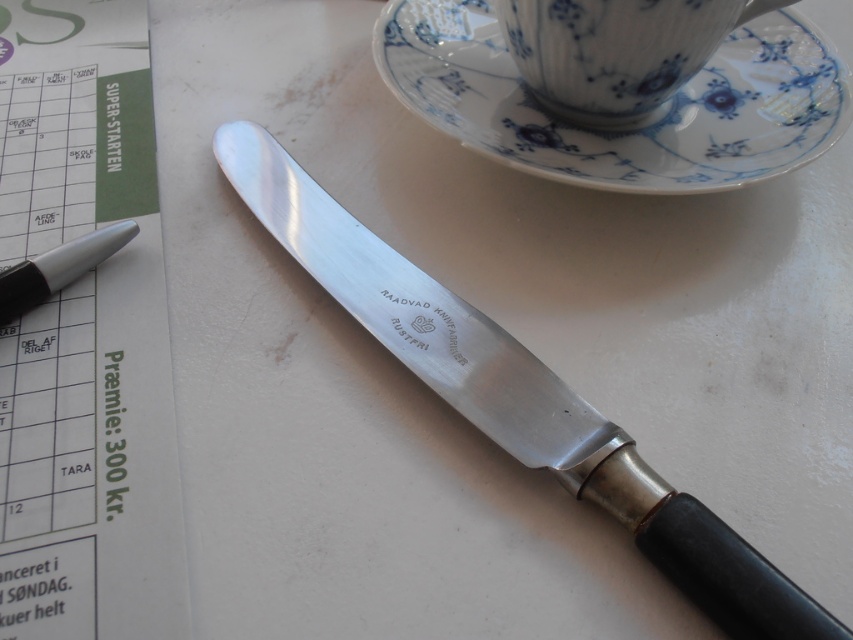
Question: Considering the real-world distances, which object is farthest from the porcelain cup at upper right?

Choices:
 (A) polished metal knife at center
 (B) metallic silver pen at left
 (C) white porcelain saucer at upper right

Answer: (B)

Question: Which point is farther from the camera taking this photo?

Choices:
 (A) (740, 620)
 (B) (695, 172)

Answer: (B)

Question: Which of the following is the closest to the observer?

Choices:
 (A) polished metal knife at center
 (B) porcelain cup at upper right

Answer: (A)

Question: Is porcelain cup at upper right behind metallic silver pen at left?

Choices:
 (A) no
 (B) yes

Answer: (B)

Question: From the image, what is the correct spatial relationship of polished metal knife at center in relation to metallic silver pen at left?

Choices:
 (A) right
 (B) left

Answer: (A)

Question: Does polished metal knife at center have a lesser width compared to white porcelain saucer at upper right?

Choices:
 (A) no
 (B) yes

Answer: (B)